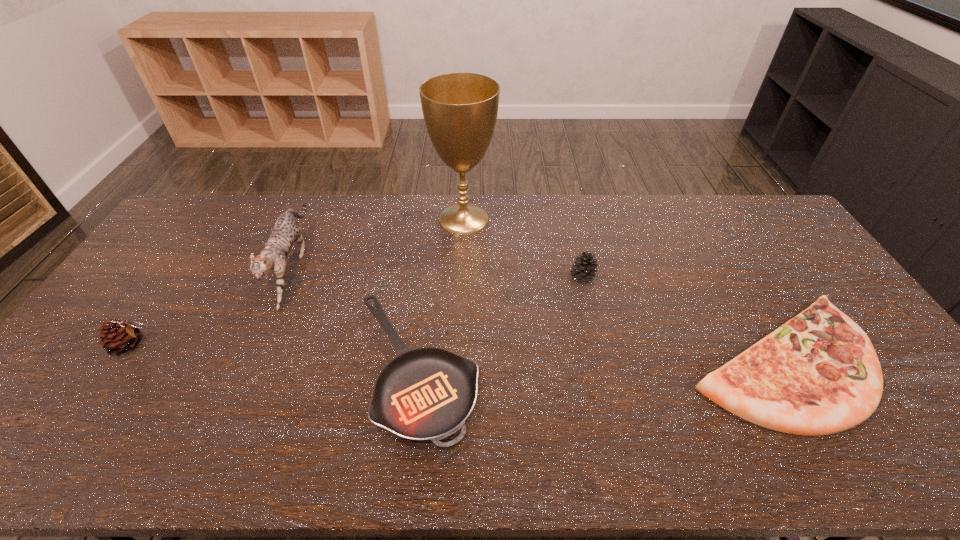
This screenshot has height=540, width=960. Identify the location of object located at the left edge. (119, 336).

At what (x,y) coordinates should I click in order to perform the action: click on object positioned at the right edge. Please return your answer as a coordinate pair (x, y). The width and height of the screenshot is (960, 540). Looking at the image, I should click on (818, 374).

The width and height of the screenshot is (960, 540). I want to click on object located in the near right corner section of the desktop, so click(x=818, y=374).

At what (x,y) coordinates should I click in order to perform the action: click on vacant space at the far edge of the desktop. Please return your answer as a coordinate pair (x, y). The width and height of the screenshot is (960, 540). Looking at the image, I should click on (520, 208).

In the image, there is a desktop. Where is `free space at the near edge`? Image resolution: width=960 pixels, height=540 pixels. free space at the near edge is located at coordinates (577, 435).

At what (x,y) coordinates should I click in order to perform the action: click on free space at the right edge of the desktop. Please return your answer as a coordinate pair (x, y). The height and width of the screenshot is (540, 960). Looking at the image, I should click on (803, 271).

Locate an element on the screen. The image size is (960, 540). free spot at the far left corner of the desktop is located at coordinates (220, 212).

In the image, there is a desktop. Identify the location of vacant space at the far right corner. The height and width of the screenshot is (540, 960). click(x=780, y=225).

Locate an element on the screen. The width and height of the screenshot is (960, 540). vacant space that is in between the shortest object and the tallest object is located at coordinates (440, 294).

Find the location of a particular element. This screenshot has width=960, height=540. empty space that is in between the cat and the shortest object is located at coordinates (354, 317).